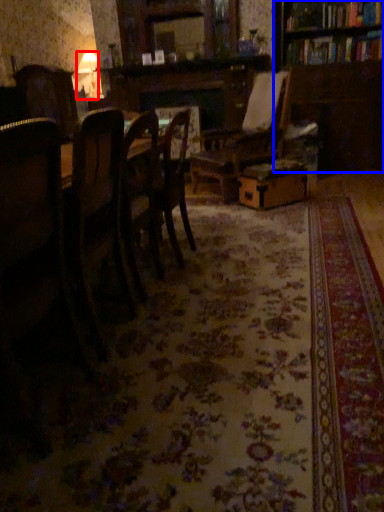
Question: Which point is closer to the camera, lamp (highlighted by a red box) or bookcase (highlighted by a blue box)?

Choices:
 (A) lamp
 (B) bookcase

Answer: (B)